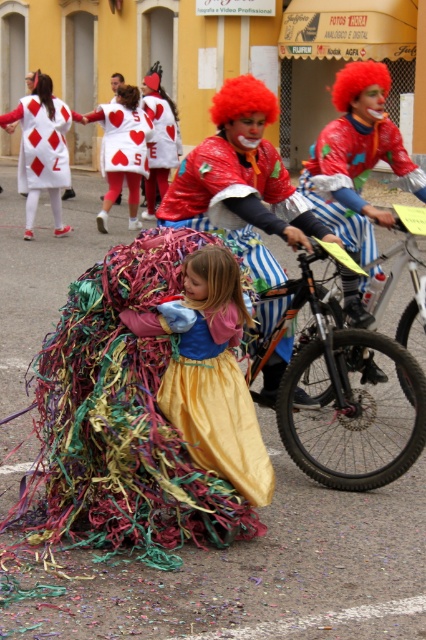
Does multicolored shredded paper at center appear over gold satin dress at center?

No.

Does point (239, 460) lie behind point (173, 305)?

That is True.

Identify the location of multicolored shredded paper at center. (152, 401).

Which is below, shiny metallic helmet at center or matte white dress at upper left?

shiny metallic helmet at center

Does shiny metallic helmet at center have a lesser height compared to matte white dress at upper left?

Yes.

Find the location of a particular element. This screenshot has height=640, width=426. shiny metallic helmet at center is located at coordinates (354, 177).

Does shiny metallic helmet at center appear on the right side of red heart-patterned costume at center?

Correct, you'll find shiny metallic helmet at center to the right of red heart-patterned costume at center.

Is point (317, 182) positioned in front of point (111, 204)?

Yes.

Measure the distance between point (405,176) and camera.

They are 17.23 feet apart.

This screenshot has height=640, width=426. What are the coordinates of `shiny metallic helmet at center` in the screenshot? It's located at (354, 177).